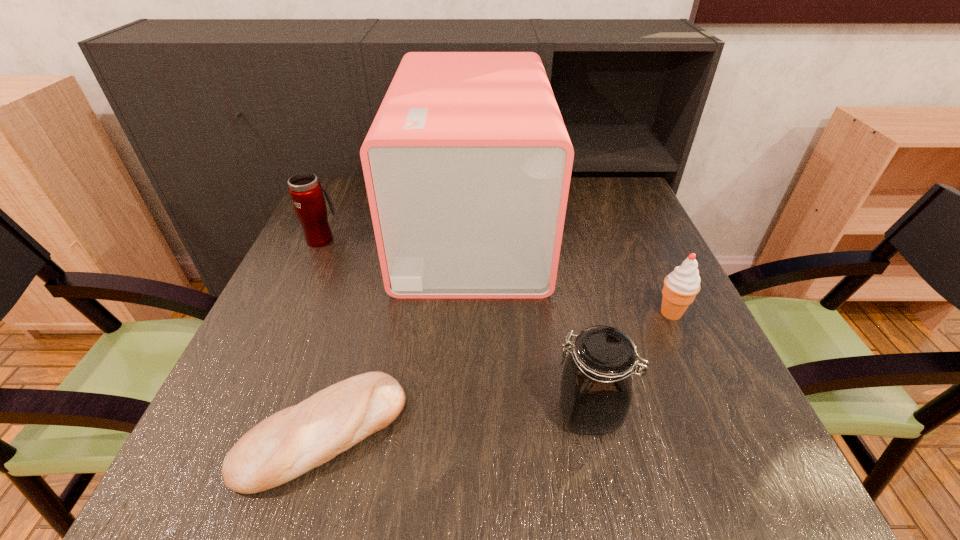
Identify the location of the tallest object. (467, 164).

Where is `thermos bottle`? This screenshot has height=540, width=960. thermos bottle is located at coordinates click(x=305, y=190).

Locate an element on the screen. The height and width of the screenshot is (540, 960). jar is located at coordinates (596, 386).

Where is `the rightmost object`? the rightmost object is located at coordinates (681, 286).

Where is `icecream`? This screenshot has height=540, width=960. icecream is located at coordinates (681, 286).

Where is `the shortest object`? the shortest object is located at coordinates (295, 440).

Locate an element on the screen. The width and height of the screenshot is (960, 540). free spot located 0.230m on the surface of the box where the text is embossed is located at coordinates (634, 228).

I want to click on free location located 0.080m on the side with the handle of the thermos bottle, so click(x=333, y=212).

This screenshot has height=540, width=960. What are the coordinates of `vacant space situated 0.230m on the side with the handle of the thermos bottle` in the screenshot? It's located at (347, 185).

The height and width of the screenshot is (540, 960). What are the coordinates of `vacant point located 0.380m on the lid of the jar` in the screenshot? It's located at (324, 412).